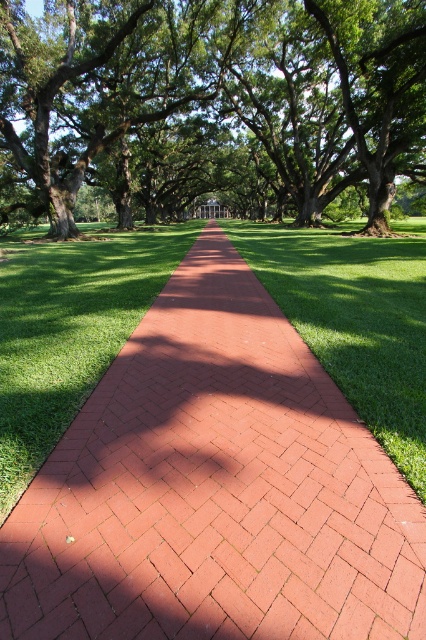
You are standing on the brick pathway and looking towards the structure in the distance. Which object, the green leafy tree at center or the green grass at center, is closer to your eye level?

The green leafy tree at center is located above green grass at center, so the green leafy tree at center is closer to your eye level.

You are standing at the starting point of the brick pathway and see two points marked on the path ahead. The first point is labeled as point (178, 124) and the second is point (242, 252). Which point is closer to your current position?

Point (242, 252) is closer to your current position because it is in front of point (178, 124) along the pathway.

You are standing on the brick pathway and want to walk towards the green grass at center. Which direction should you move relative to the green leafy tree at center?

You should move to the right of the green leafy tree at center to reach the green grass at center because the green leafy tree at center is to the left of green grass at center.